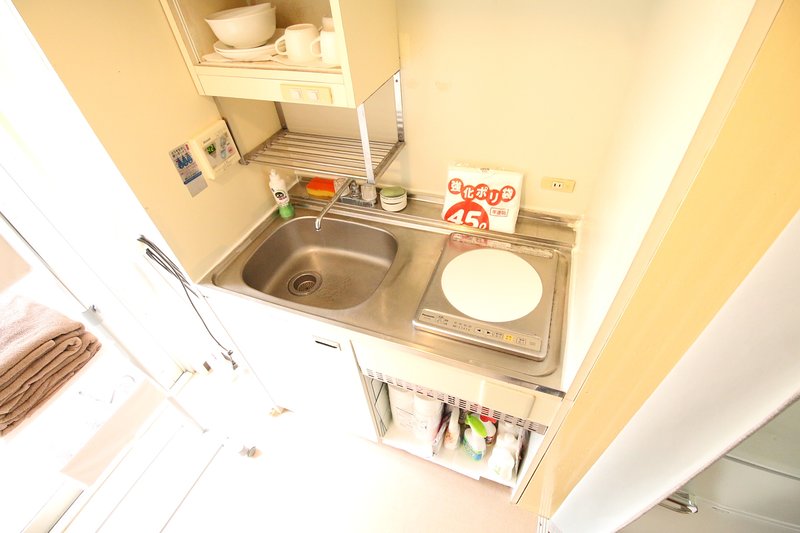
The width and height of the screenshot is (800, 533). I want to click on towels, so click(x=86, y=353).